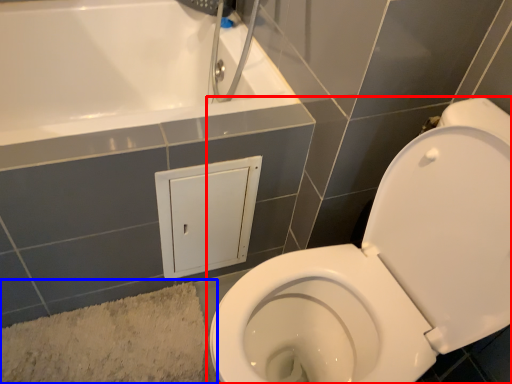
Question: Which object appears farthest to the camera in this image, toilet (highlighted by a red box) or bath mat (highlighted by a blue box)?

Choices:
 (A) toilet
 (B) bath mat

Answer: (B)